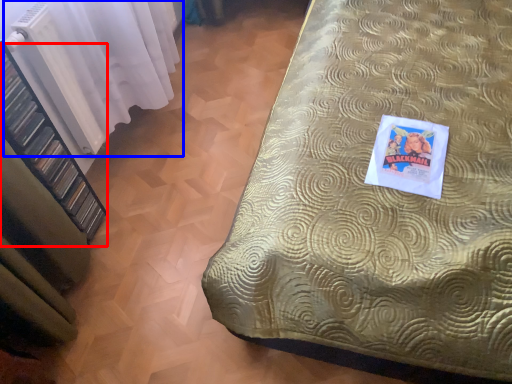
Question: Which object is further to the camera taking this photo, shelf (highlighted by a red box) or curtain (highlighted by a blue box)?

Choices:
 (A) shelf
 (B) curtain

Answer: (B)